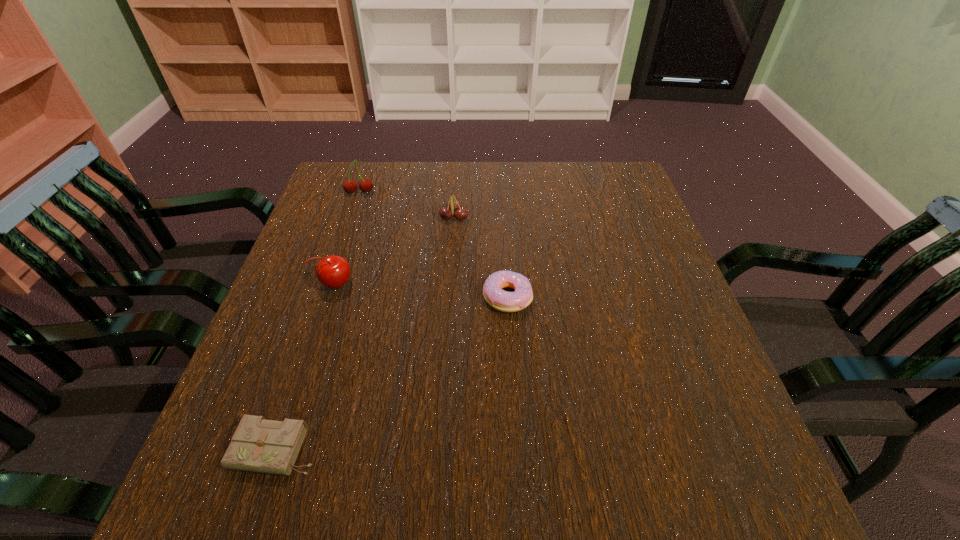
Locate an element on the screen. This screenshot has width=960, height=540. vacant region at the left edge of the desktop is located at coordinates (286, 325).

In the image, there is a desktop. At what (x,y) coordinates should I click in order to perform the action: click on vacant space at the right edge. Please return your answer as a coordinate pair (x, y). The image size is (960, 540). Looking at the image, I should click on (687, 381).

The height and width of the screenshot is (540, 960). Identify the location of free space at the far right corner. (600, 193).

Identify the location of vacant space at the near right corner. (685, 498).

Identify the location of vacant area between the second shortest object and the second tallest object. (421, 291).

The image size is (960, 540). I want to click on free space between the doughnut and the second shortest cherry, so click(x=421, y=291).

This screenshot has width=960, height=540. What are the coordinates of `free spot between the farthest object and the shortest object` in the screenshot? It's located at click(x=318, y=321).

You are a GUI agent. You are given a task and a screenshot of the screen. Output one action in this format:
    pyautogui.click(x=<x>, y=<y>)
    Task: Click on the vacant space that's between the shortest cherry and the rightmost object
    
    Given the screenshot: What is the action you would take?
    pyautogui.click(x=481, y=258)

Image resolution: width=960 pixels, height=540 pixels. What are the coordinates of `vacant space that is in between the rightmost cherry and the second shortest cherry` in the screenshot? It's located at (395, 251).

Where is `empty space that is in between the farthest object and the second tallest cherry`? empty space that is in between the farthest object and the second tallest cherry is located at coordinates (348, 238).